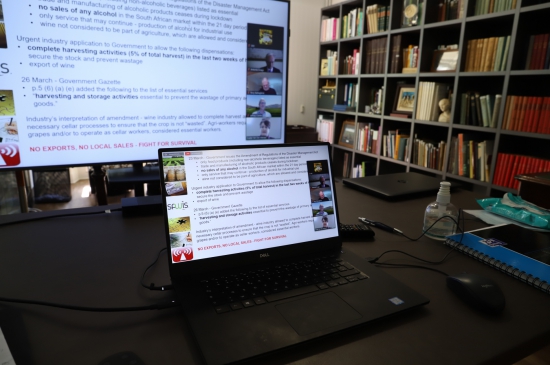
Find the location of a particular element. Image resolution: width=550 pixels, height=365 pixels. table is located at coordinates (78, 262).